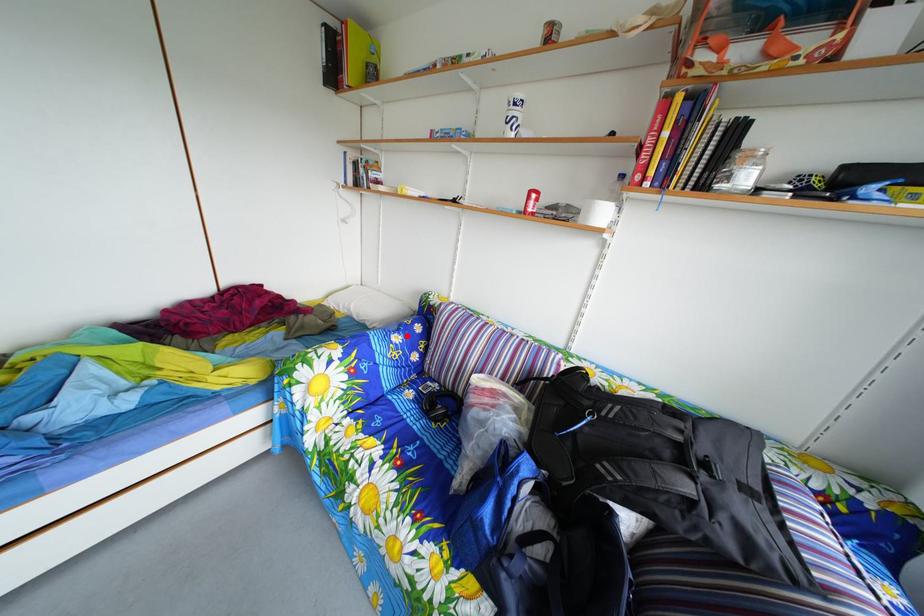
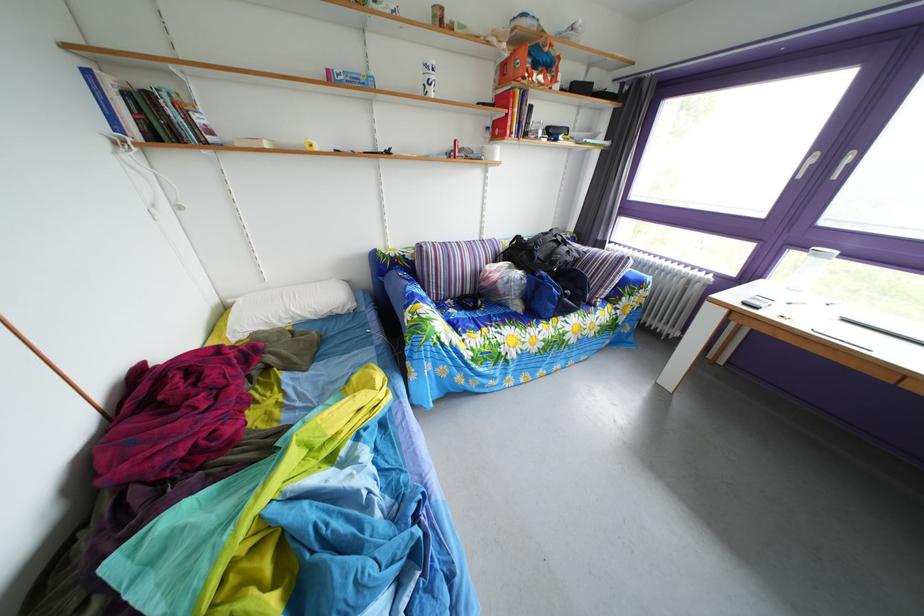
Find the pixel in the second image that matches the highlighted location in the first image.

(417, 290)